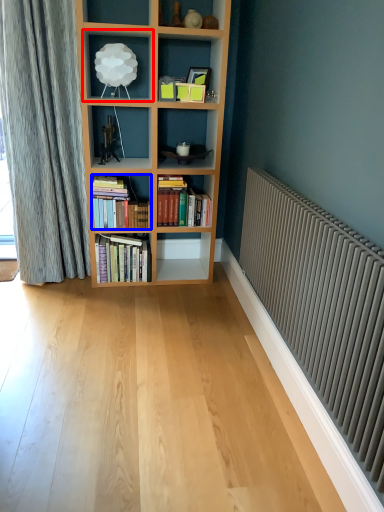
Question: Which of the following is the closest to the observer, shelf (highlighted by a red box) or book (highlighted by a blue box)?

Choices:
 (A) shelf
 (B) book

Answer: (A)